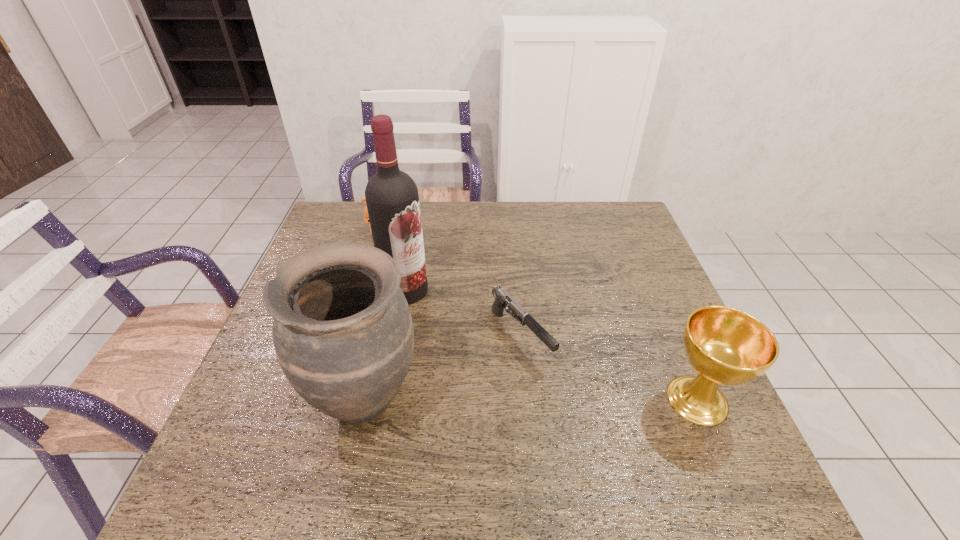
The height and width of the screenshot is (540, 960). I want to click on the fourth shortest object, so click(x=343, y=334).

Find the location of a particular element. Image resolution: width=960 pixels, height=540 pixels. chalice is located at coordinates (726, 346).

You are a GUI agent. You are given a task and a screenshot of the screen. Output one action in this format:
    pyautogui.click(x=<x>, y=<y>)
    Task: Click on the third shortest object
    The width and height of the screenshot is (960, 540).
    Given the screenshot: What is the action you would take?
    726,346

Find the location of a particular element. The image size is (960, 540). wine bottle is located at coordinates pyautogui.click(x=392, y=198).

This screenshot has height=540, width=960. I want to click on the tallest object, so click(x=392, y=198).

Where is `the second shortest object`? the second shortest object is located at coordinates (366, 218).

Locate an element on the screen. the farthest object is located at coordinates (366, 218).

You are a GUI agent. You are given a task and a screenshot of the screen. Output one action in this format:
    pyautogui.click(x=<x>, y=<y>)
    Task: Click on the gun
    This screenshot has height=540, width=960.
    Given the screenshot: What is the action you would take?
    pyautogui.click(x=502, y=299)

You are a GUI agent. You are given a task and a screenshot of the screen. Output one action in this format:
    pyautogui.click(x=<x>, y=<y>)
    Task: Click on the second object from right to left
    Image resolution: width=960 pixels, height=540 pixels.
    Given the screenshot: What is the action you would take?
    pyautogui.click(x=502, y=299)

Identify the location of free region located 0.290m on the right of the second tallest object. (556, 400).